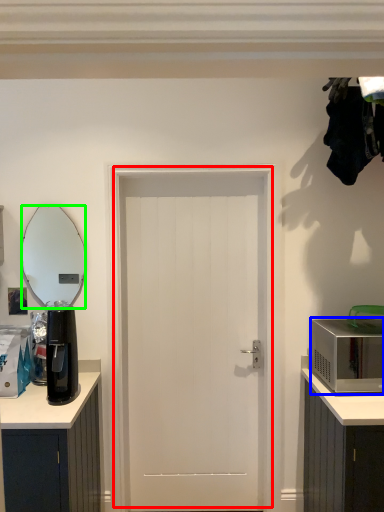
Question: Considering the real-world distances, which object is closest to door (highlighted by a red box)? microwave oven (highlighted by a blue box) or mirror (highlighted by a green box).

Choices:
 (A) microwave oven
 (B) mirror

Answer: (A)